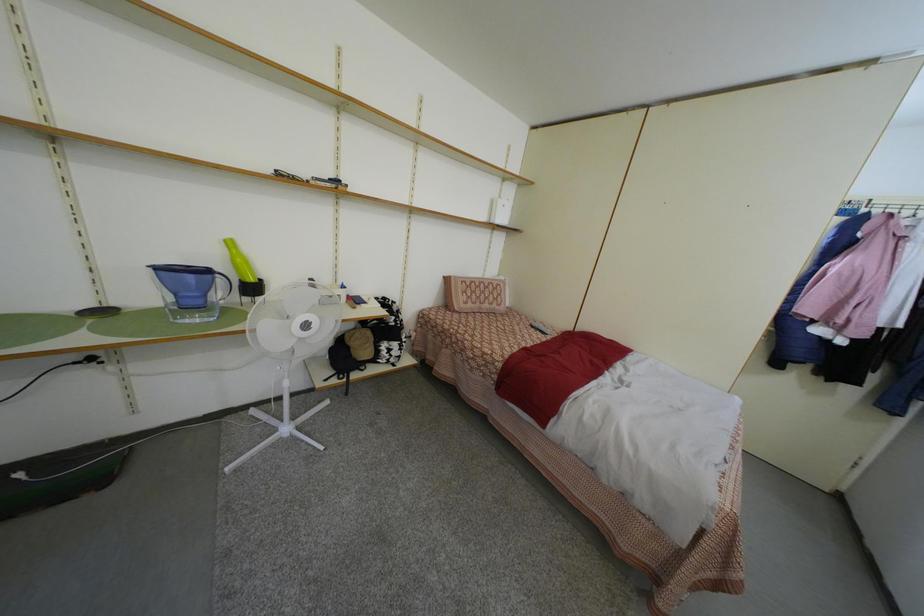
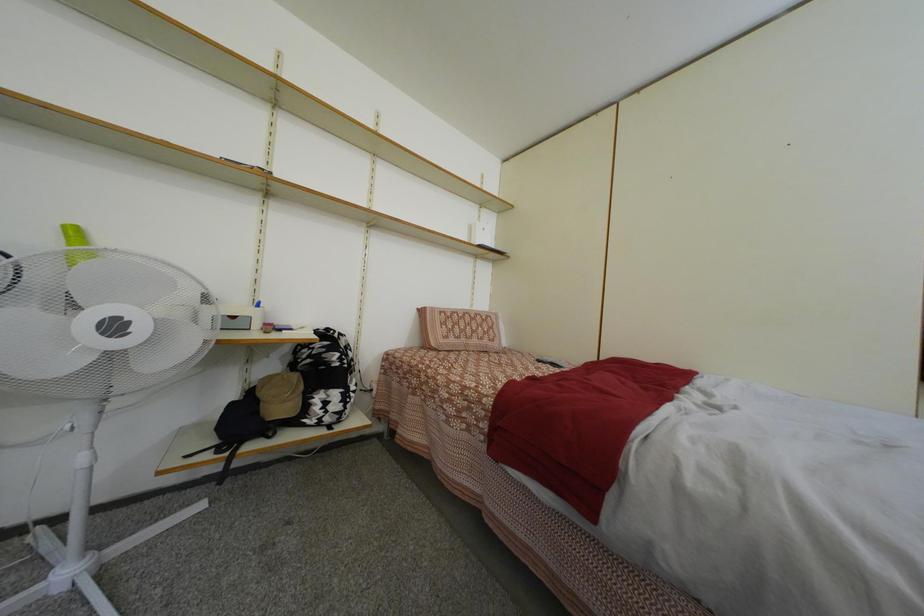
Question: Which direction would the cameraman need to move to produce the second image? Reply with the corresponding letter.

Choices:
 (A) Left
 (B) Right
 (C) Forward
 (D) Backward

Answer: (C)